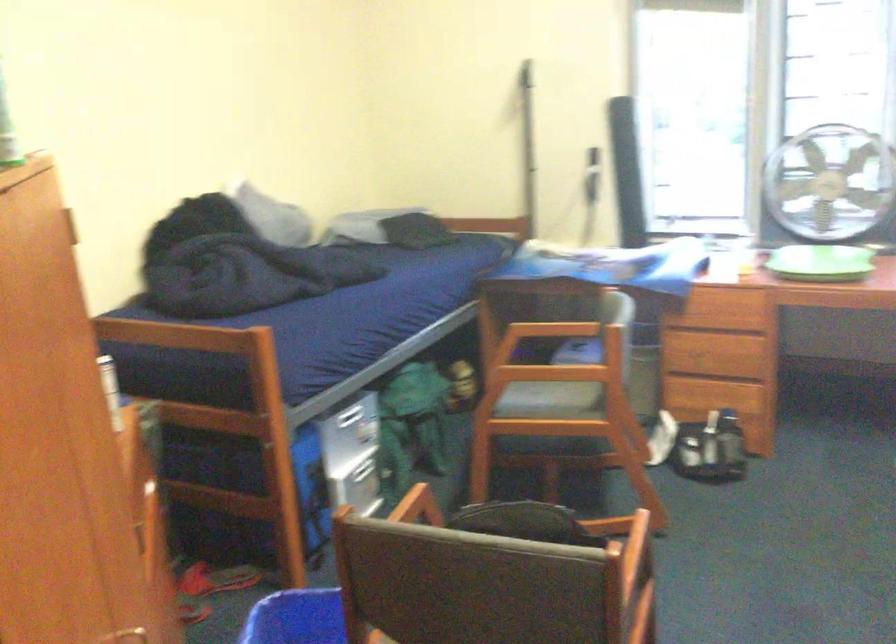
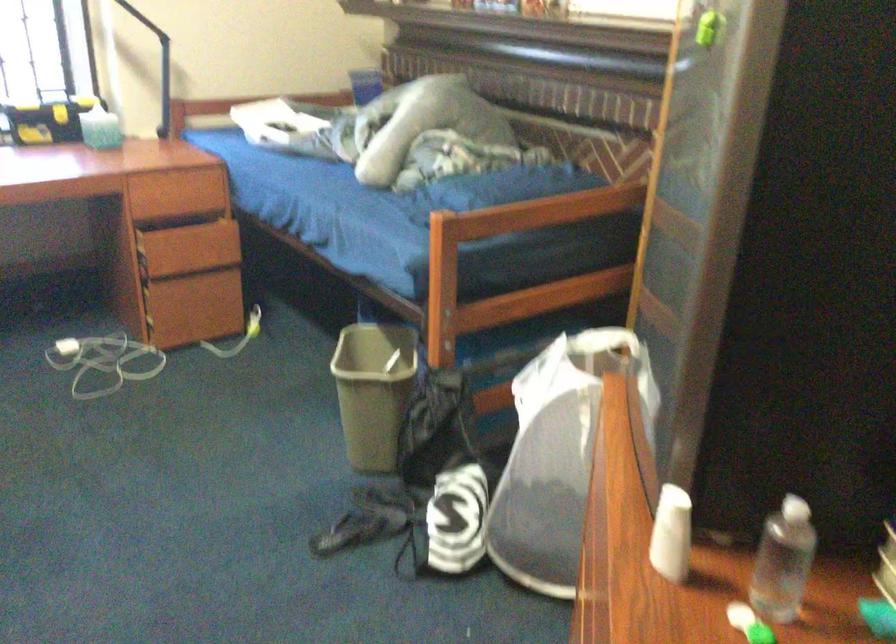
Question: The first image is from the beginning of the video and the second image is from the end. How did the camera likely rotate when shooting the video?

Choices:
 (A) Left
 (B) Right
 (C) Up
 (D) Down

Answer: (B)